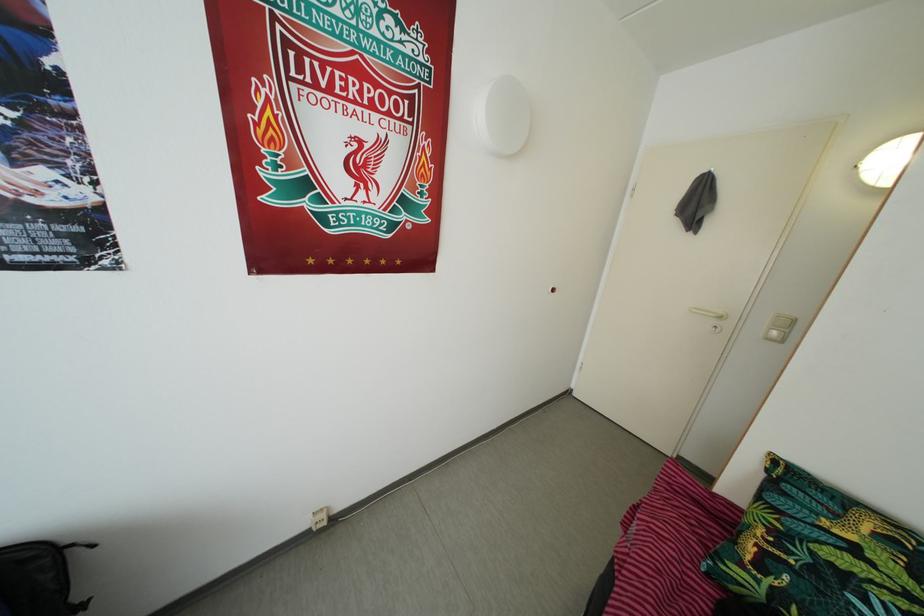
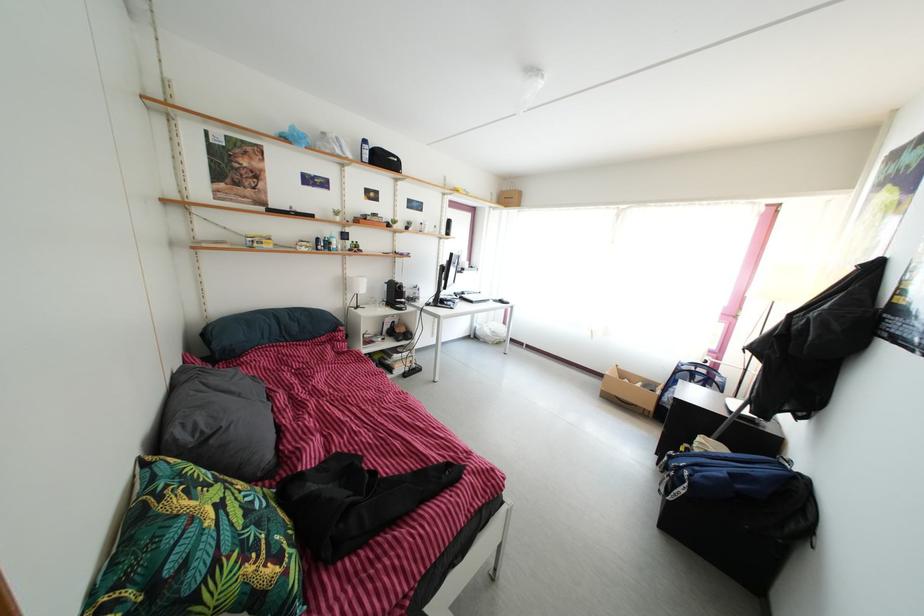
Find the pixel in the second image that matches the point at 820,578 in the first image.

(264, 533)